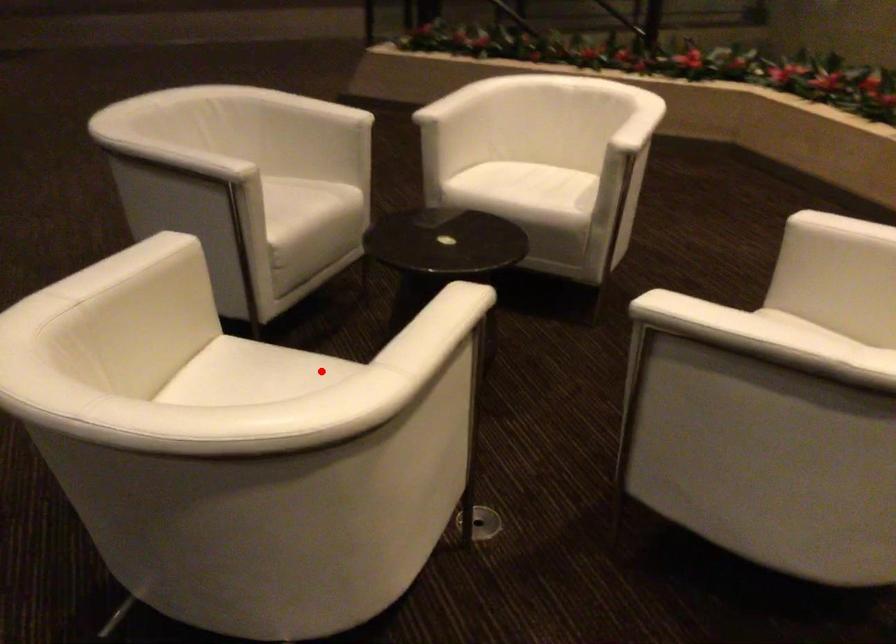
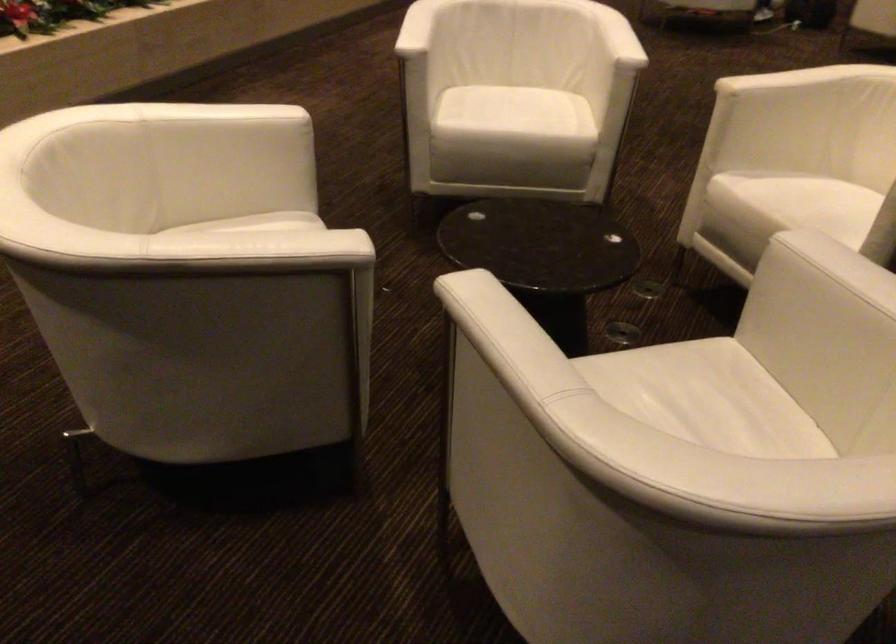
Question: I am providing you with two images of the same scene from different viewpoints. Given a red point in image1, look at the same physical point in image2. Is it:

Choices:
 (A) Closer to the viewpoint
 (B) Farther from the viewpoint

Answer: (B)